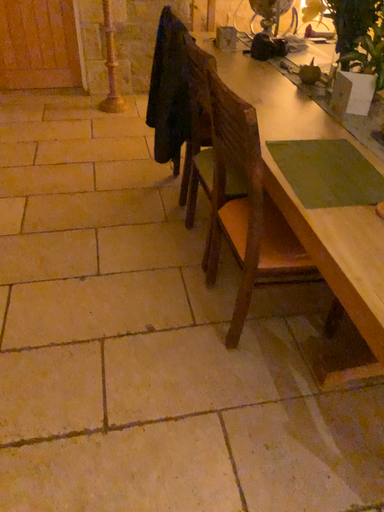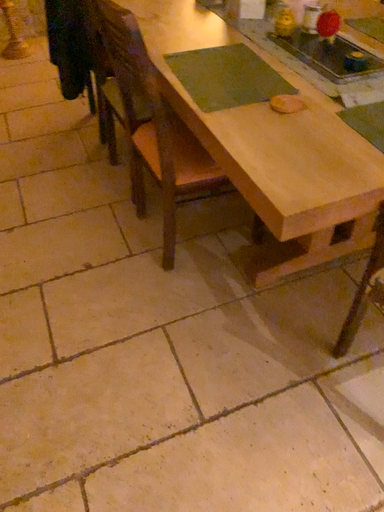
Question: Which way did the camera rotate in the video?

Choices:
 (A) rotated upward
 (B) rotated downward

Answer: (B)